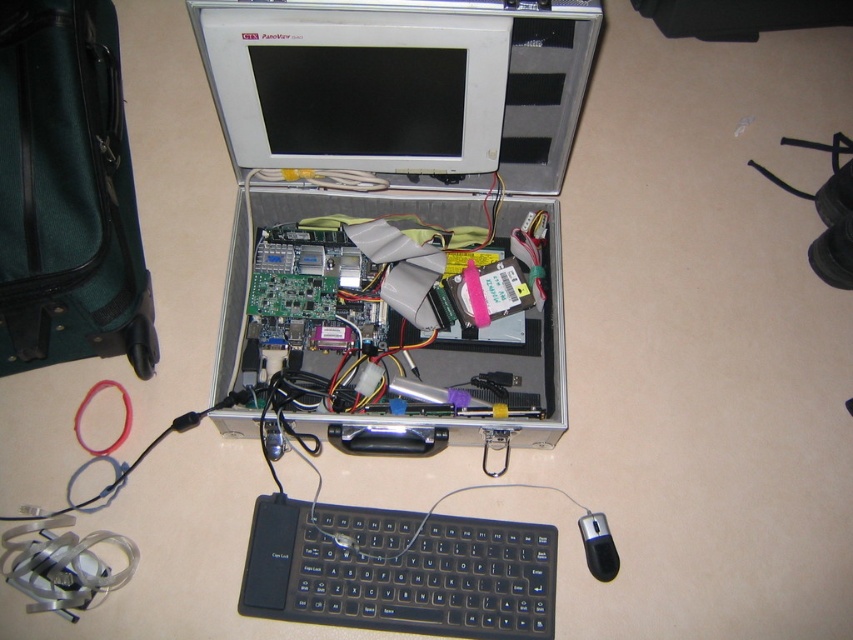
In the scene shown: You are setting up a portable workspace using the briefcase shown. You need to place the silver metallic computer at center and the black plastic keyboard at lower center inside the briefcase. Considering their sizes, which object will require more space?

The silver metallic computer at center requires more space because it has a larger size compared to the black plastic keyboard at lower center.

You are a technician working on the briefcase workspace. You need to place a small tool exactly halfway between the point at coordinate point (x=409, y=513) and the point at coordinate point (x=589, y=556). Will the tool be closer to the camera than both points?

The tool placed halfway between point (x=409, y=513) and point (x=589, y=556) will be closer to the camera than point (x=589, y=556) but not closer than point (x=409, y=513) since it is the midpoint between the two points.

You are setting up a portable workstation using the items in the image. You need to place the silver metallic computer at center and the black plastic mouse at lower right on a small shelf. The shelf can only hold items that are smaller than 15 inches in any dimension. Based on the image description, will both items fit on the shelf?

The silver metallic computer at center is bigger than the black plastic mouse at lower right. Since the shelf requires items to be smaller than 15 inches, but we don not have exact measurements, it is uncertain if both will fit. However, if the mouse is under 15 inches, the computer might exceed the limit due to its larger size.